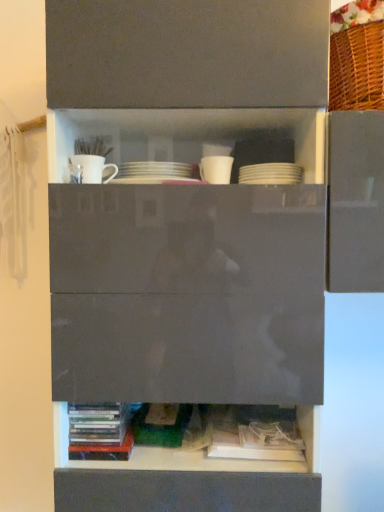
Question: Is white paper book at lower center, which is counted as the second book, starting from the left, wider than white matte mug at upper left, marked as the 1th tableware in a left-to-right arrangement?

Choices:
 (A) no
 (B) yes

Answer: (B)

Question: Is white paper book at lower center, the first book viewed from the right, oriented away from white matte mug at upper left, marked as the 1th tableware in a left-to-right arrangement?

Choices:
 (A) no
 (B) yes

Answer: (A)

Question: Can you confirm if white paper book at lower center, which is counted as the second book, starting from the left, is smaller than white matte mug at upper left, marked as the 1th tableware in a left-to-right arrangement?

Choices:
 (A) yes
 (B) no

Answer: (B)

Question: Is there a large distance between white paper book at lower center, which is counted as the second book, starting from the left, and white matte mug at upper left, which appears as the third tableware when viewed from the right?

Choices:
 (A) no
 (B) yes

Answer: (A)

Question: From the image's perspective, would you say white paper book at lower center, the first book viewed from the right, is shown under white matte mug at upper left, marked as the 1th tableware in a left-to-right arrangement?

Choices:
 (A) yes
 (B) no

Answer: (A)

Question: Considering the relative positions of white matte mug at upper center, acting as the second tableware starting from the right, and white matte mug at upper left, marked as the 1th tableware in a left-to-right arrangement, in the image provided, is white matte mug at upper center, acting as the second tableware starting from the right, to the left or to the right of white matte mug at upper left, marked as the 1th tableware in a left-to-right arrangement,?

Choices:
 (A) right
 (B) left

Answer: (A)

Question: Which is correct: white matte mug at upper center, positioned as the 2th tableware in left-to-right order, is inside white matte mug at upper left, marked as the 1th tableware in a left-to-right arrangement, or outside of it?

Choices:
 (A) outside
 (B) inside

Answer: (A)

Question: In terms of height, does white matte mug at upper center, acting as the second tableware starting from the right, look taller or shorter compared to white matte mug at upper left, marked as the 1th tableware in a left-to-right arrangement?

Choices:
 (A) short
 (B) tall

Answer: (B)

Question: From the image's perspective, is white matte mug at upper center, acting as the second tableware starting from the right, located above or below white matte mug at upper left, marked as the 1th tableware in a left-to-right arrangement?

Choices:
 (A) above
 (B) below

Answer: (B)

Question: Relative to white matte plates at upper center, positioned as the third tableware in left-to-right order, is white paper book at lower center, the first book viewed from the right, in front or behind?

Choices:
 (A) front
 (B) behind

Answer: (B)

Question: From a real-world perspective, is white paper book at lower center, the first book viewed from the right, above or below white matte plates at upper center, which appears as the 1th tableware when viewed from the right?

Choices:
 (A) above
 (B) below

Answer: (B)

Question: From the image's perspective, is white paper book at lower center, which is counted as the second book, starting from the left, positioned above or below white matte plates at upper center, positioned as the third tableware in left-to-right order?

Choices:
 (A) above
 (B) below

Answer: (B)

Question: Considering the relative positions of white paper book at lower center, the first book viewed from the right, and white matte plates at upper center, which appears as the 1th tableware when viewed from the right, in the image provided, is white paper book at lower center, the first book viewed from the right, to the left or to the right of white matte plates at upper center, which appears as the 1th tableware when viewed from the right,?

Choices:
 (A) left
 (B) right

Answer: (A)

Question: Which is correct: white matte mug at upper left, marked as the 1th tableware in a left-to-right arrangement, is inside multicolored plastic books at lower left, the first book from the left, or outside of it?

Choices:
 (A) outside
 (B) inside

Answer: (A)

Question: Considering their positions, is white matte mug at upper left, which appears as the third tableware when viewed from the right, located in front of or behind multicolored plastic books at lower left, placed as the 2th book when sorted from right to left?

Choices:
 (A) behind
 (B) front

Answer: (A)